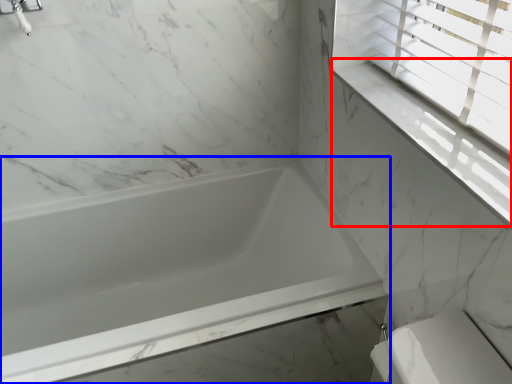
Question: Which object is further to the camera taking this photo, window sill (highlighted by a red box) or bathtub (highlighted by a blue box)?

Choices:
 (A) window sill
 (B) bathtub

Answer: (B)